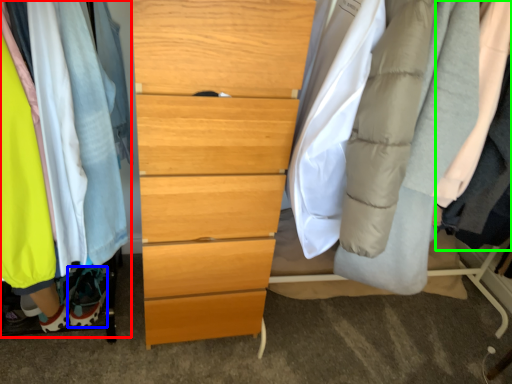
Question: Considering the real-world distances, which object is farthest from closet (highlighted by a red box)? shoe (highlighted by a blue box) or robe (highlighted by a green box)?

Choices:
 (A) shoe
 (B) robe

Answer: (B)